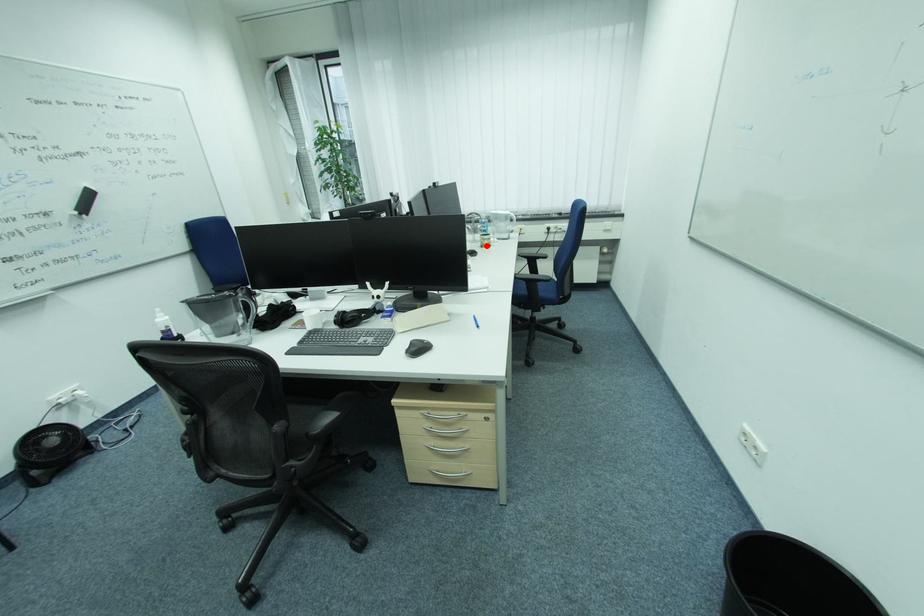
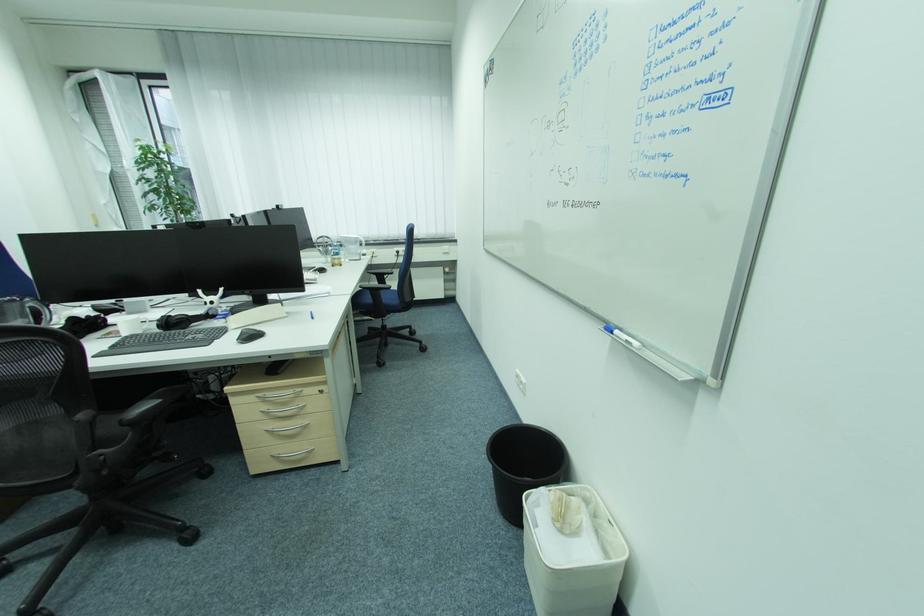
Question: I am providing you with two images of the same scene from different viewpoints. A red point is marked on the first image. Can you still see the location of the red point in image 2?

Choices:
 (A) Yes
 (B) No

Answer: (A)